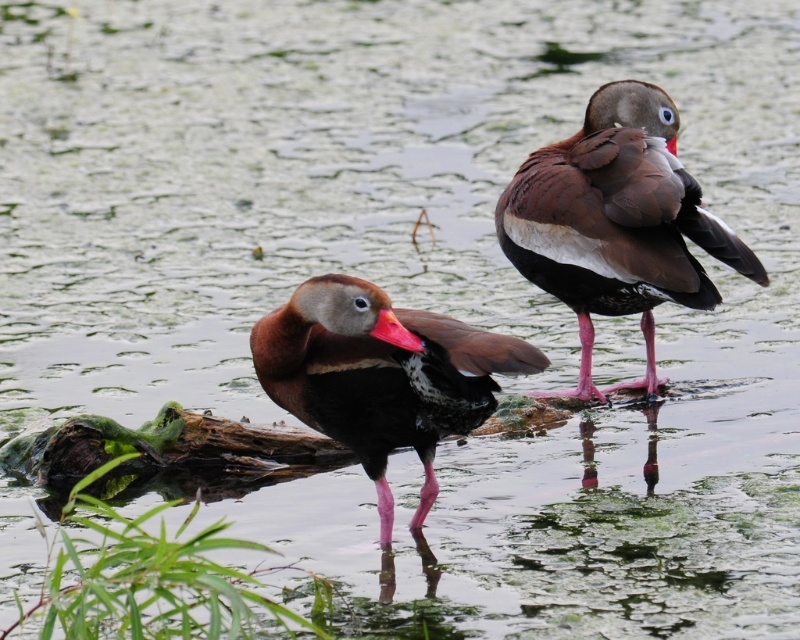
Question: Which of these objects is positioned farthest from the rubberized red beak at center?

Choices:
 (A) brown glossy duck at upper right
 (B) brown glossy duck at center

Answer: (A)

Question: Which of the following is the farthest from the observer?

Choices:
 (A) rubberized red beak at center
 (B) brown glossy duck at upper right

Answer: (B)

Question: Does brown glossy duck at center appear on the right side of rubberized red beak at center?

Choices:
 (A) yes
 (B) no

Answer: (A)

Question: Is the position of brown glossy duck at center more distant than that of rubberized red beak at center?

Choices:
 (A) no
 (B) yes

Answer: (B)

Question: Which of the following is the farthest from the observer?

Choices:
 (A) brown glossy duck at center
 (B) brown glossy duck at upper right

Answer: (B)

Question: Does brown glossy duck at center appear under rubberized red beak at center?

Choices:
 (A) no
 (B) yes

Answer: (B)